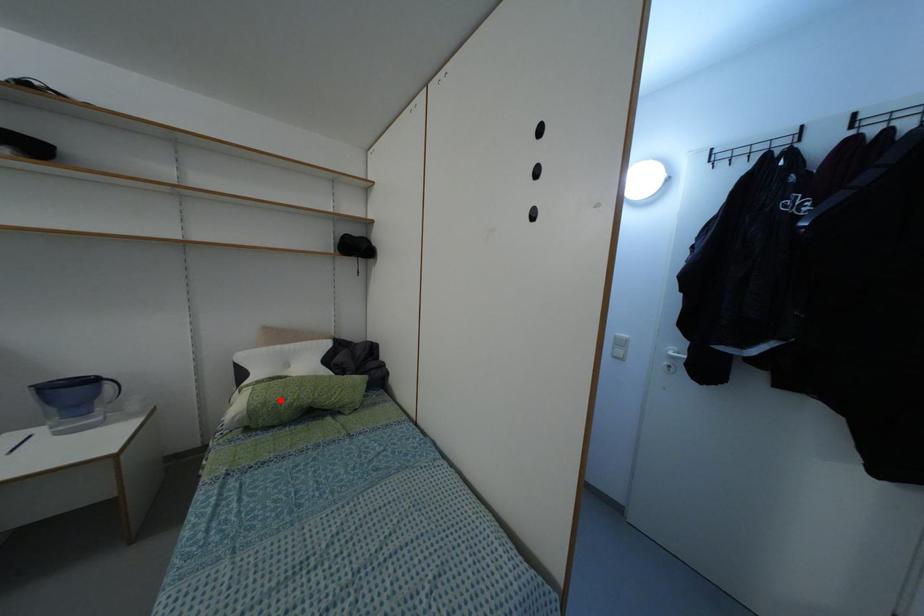
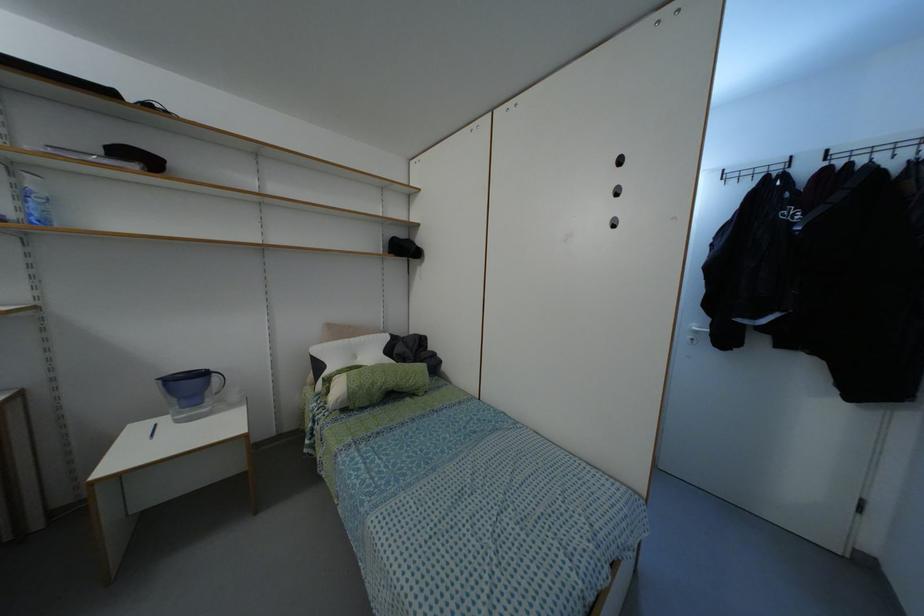
Find the pixel in the second image that matches the highlighted location in the first image.

(371, 384)